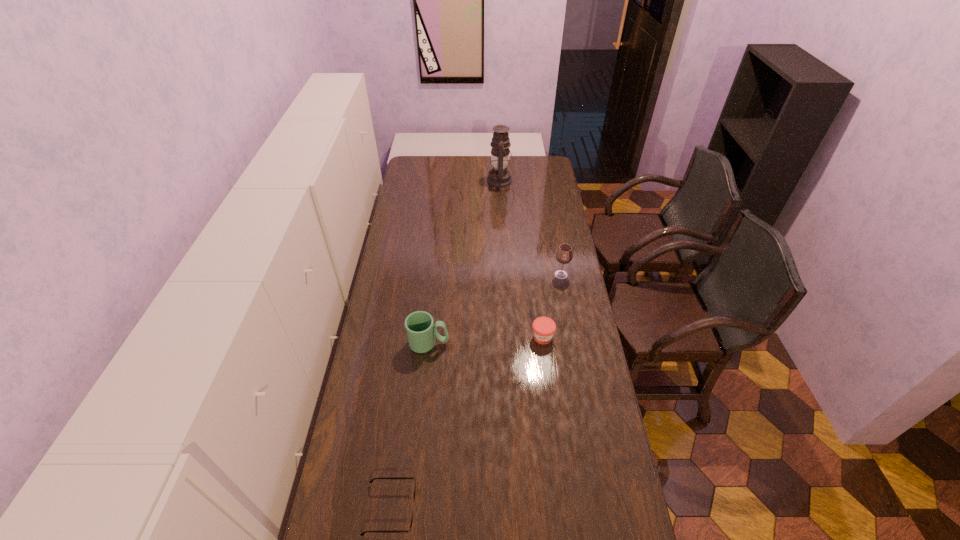
This screenshot has width=960, height=540. I want to click on free location located on the front of the second farthest object, so click(572, 338).

The width and height of the screenshot is (960, 540). I want to click on vacant space situated 0.310m on the side of the third shortest object with the handle, so click(531, 343).

At what (x,y) coordinates should I click in order to perform the action: click on vacant space situated on the front label of the second object from right to left. Please return your answer as a coordinate pair (x, y). Looking at the image, I should click on (554, 429).

Locate an element on the screen. vacant space located 0.080m at the hinge ends of the spectacles is located at coordinates (444, 509).

Find the location of a particular element. This screenshot has width=960, height=540. object present at the far edge is located at coordinates (499, 176).

Where is `mug situated at the left edge`? Image resolution: width=960 pixels, height=540 pixels. mug situated at the left edge is located at coordinates (421, 332).

Image resolution: width=960 pixels, height=540 pixels. Identify the location of spectacles at the left edge. (409, 530).

Locate an element on the screen. wineglass that is at the right edge is located at coordinates (564, 255).

Where is `jam positioned at the right edge`? The height and width of the screenshot is (540, 960). jam positioned at the right edge is located at coordinates (543, 327).

Locate an element on the screen. free space at the far edge of the desktop is located at coordinates (467, 171).